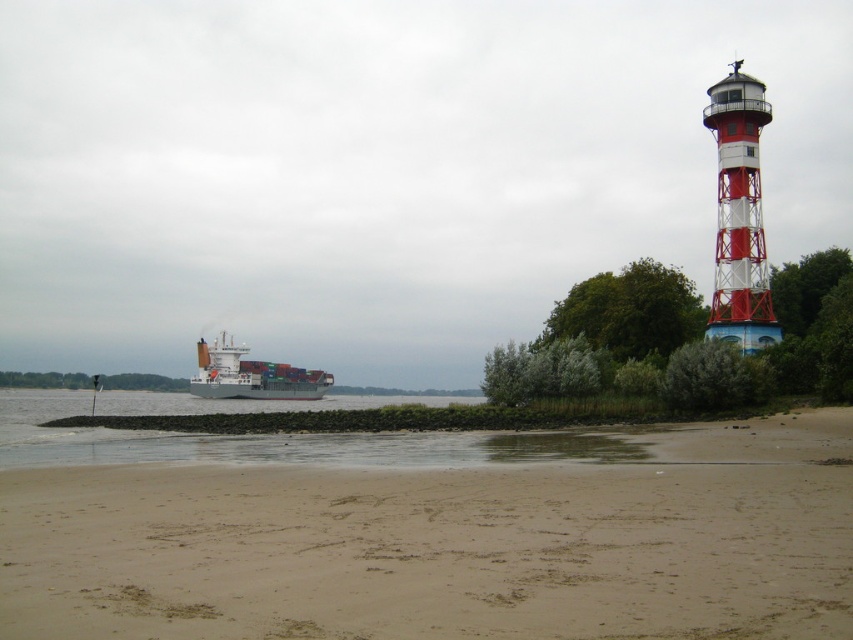
Question: Is sandy at lower center smaller than gray matte container ship at left?

Choices:
 (A) yes
 (B) no

Answer: (A)

Question: Which object is positioned farthest from the red and white striped lighthouse at upper right?

Choices:
 (A) sandy at lower center
 (B) gray matte container ship at left

Answer: (B)

Question: Does sandy at lower center have a lesser width compared to red and white striped lighthouse at upper right?

Choices:
 (A) yes
 (B) no

Answer: (B)

Question: Which point is closer to the camera taking this photo?

Choices:
 (A) (764, 278)
 (B) (262, 371)
 (C) (332, 500)

Answer: (C)

Question: Estimate the real-world distances between objects in this image. Which object is closer to the sandy at lower center?

Choices:
 (A) red and white striped lighthouse at upper right
 (B) gray matte container ship at left

Answer: (A)

Question: Can you confirm if sandy at lower center is positioned below gray matte container ship at left?

Choices:
 (A) yes
 (B) no

Answer: (B)